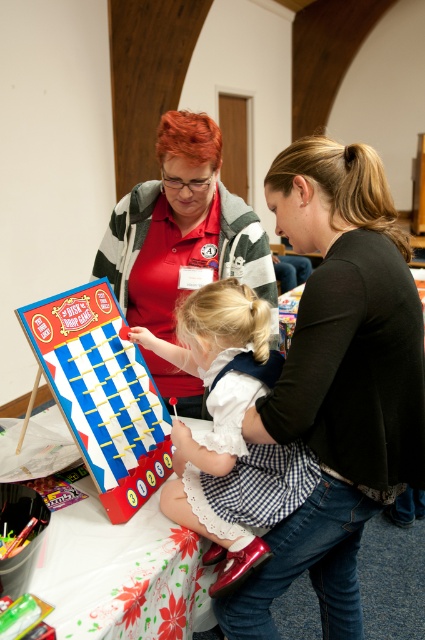
Can you confirm if black matte shirt at center is smaller than white checkered skirt at center?

No, black matte shirt at center is not smaller than white checkered skirt at center.

Does point (411, 278) come in front of point (209, 298)?

Yes.

What do you see at coordinates (337, 380) in the screenshot? The image size is (425, 640). I see `black matte shirt at center` at bounding box center [337, 380].

This screenshot has width=425, height=640. Identify the location of black matte shirt at center. (337, 380).

Can you confirm if matte red shirt at center is positioned below wooden table at center?

Actually, matte red shirt at center is above wooden table at center.

Is matte red shirt at center thinner than wooden table at center?

Yes.

This screenshot has width=425, height=640. Find the location of `matte red shirt at center`. matte red shirt at center is located at coordinates (181, 228).

Can you confirm if black matte shirt at center is shorter than matte plastic game board at lower left?

In fact, black matte shirt at center may be taller than matte plastic game board at lower left.

Which of these two, black matte shirt at center or matte plastic game board at lower left, stands shorter?

Standing shorter between the two is matte plastic game board at lower left.

Image resolution: width=425 pixels, height=640 pixels. In order to click on black matte shirt at center in this screenshot , I will do `click(337, 380)`.